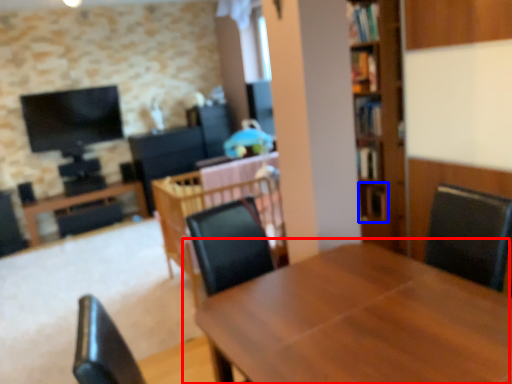
Question: Which point is further to the camera, table (highlighted by a red box) or shelf (highlighted by a blue box)?

Choices:
 (A) table
 (B) shelf

Answer: (B)